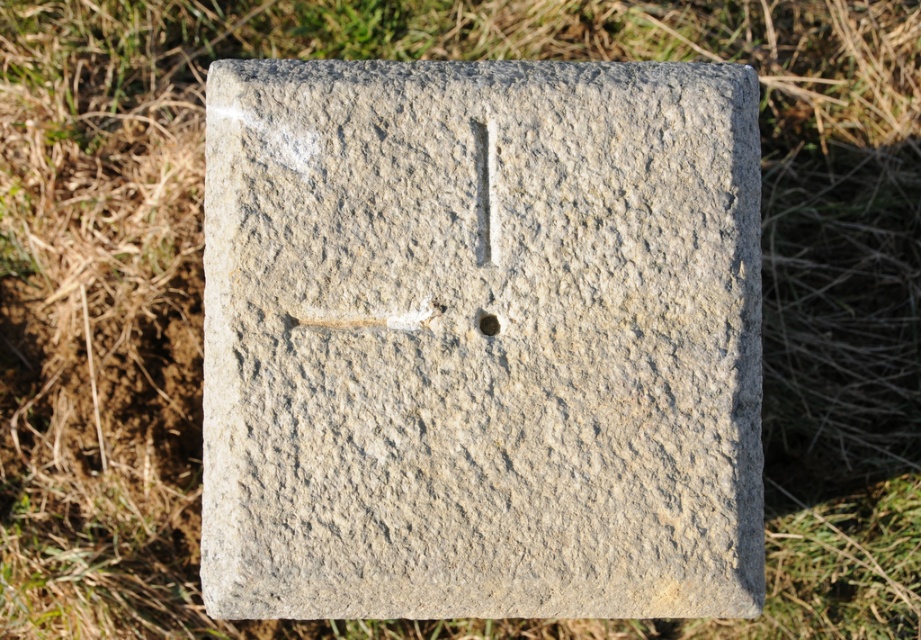
You are a gardener planning to place a new flower pot between the gray stone gravestone at center and the black stone hole at center. Which object should you place the flower pot closer to if you want it to be near the wider object?

The gray stone gravestone at center is wider than the black stone hole at center, so you should place the flower pot closer to the gray stone gravestone at center.

You are standing in a field and see the gray stone gravestone at center and the black stone hole at center. Which object is positioned higher up?

The black stone hole at center is positioned higher up than the gray stone gravestone at center.

You are a gardener trying to plant a new flower. The gray stone gravestone at center is in the way. Can you move the flower 10 inches away from the gravestone to the black stone hole at center without getting too close?

The distance between the gray stone gravestone at center and the black stone hole at center is 10.45 inches. Since you want to move the flower 10 inches away from the gravestone, it can be placed near the black stone hole at center as the distance is sufficient.